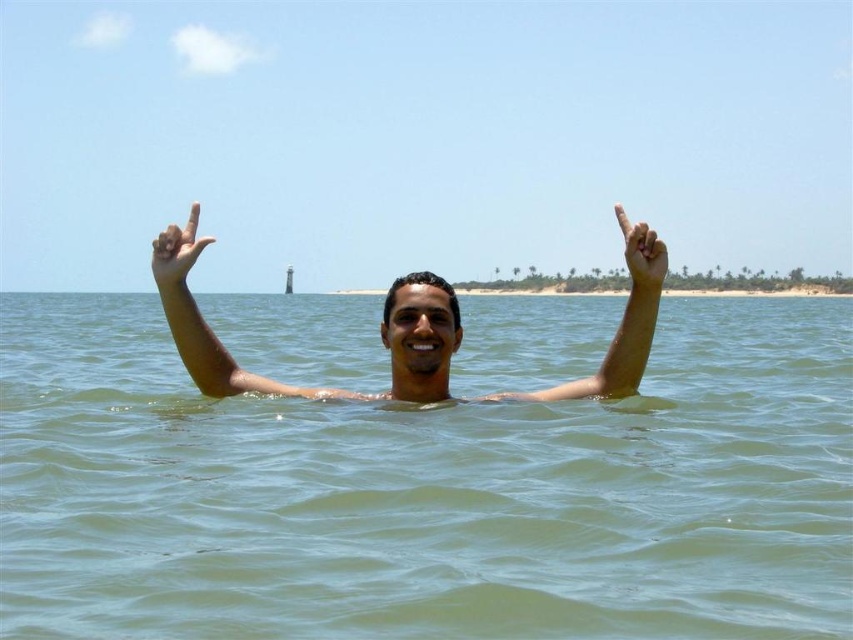
Between skinny tan arm at upper center and matte skin hand at upper center, which one is positioned lower?

Positioned lower is skinny tan arm at upper center.

Is skinny tan arm at upper center taller than matte skin hand at upper center?

Indeed, skinny tan arm at upper center has a greater height compared to matte skin hand at upper center.

Is point (643, 310) farther from viewer compared to point (171, 266)?

Yes.

The image size is (853, 640). I want to click on skinny tan arm at upper center, so click(x=619, y=323).

Based on the photo, can you confirm if smooth skin man at center is bigger than matte skin hand at upper center?

Actually, smooth skin man at center might be smaller than matte skin hand at upper center.

Does point (582, 388) come closer to viewer compared to point (206, 237)?

That is False.

Between point (656, 298) and point (171, 284), which one is positioned in front?

Point (171, 284)

You are a GUI agent. You are given a task and a screenshot of the screen. Output one action in this format:
    pyautogui.click(x=<x>, y=<y>)
    Task: Click on the smooth skin man at center
    This screenshot has height=640, width=853.
    Given the screenshot: What is the action you would take?
    pyautogui.click(x=334, y=388)

From the picture: How far apart are greenish water at upper center and skinny tan arm at upper center?

greenish water at upper center and skinny tan arm at upper center are 31.67 meters apart from each other.

Which is more to the right, greenish water at upper center or skinny tan arm at upper center?

Positioned to the right is greenish water at upper center.

Is point (96, 595) closer to camera compared to point (636, 262)?

Yes, it is.

Locate an element on the screen. greenish water at upper center is located at coordinates (426, 492).